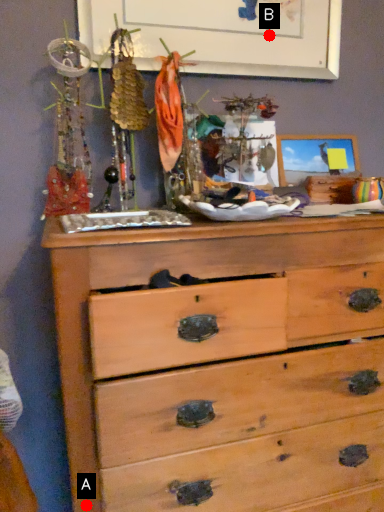
Question: Two points are circled on the image, labeled by A and B beside each circle. Which of the following is the farthest from the observer?

Choices:
 (A) A is further
 (B) B is further

Answer: (B)